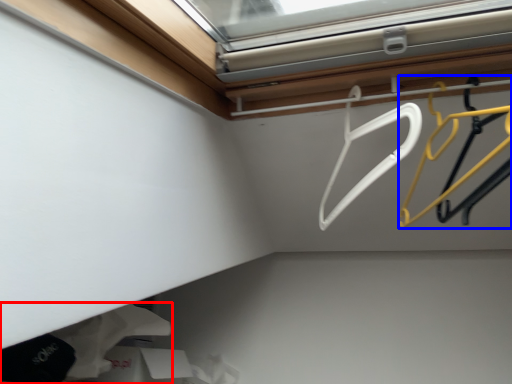
Question: Among these objects, which one is farthest to the camera, clothing (highlighted by a red box) or hanger (highlighted by a blue box)?

Choices:
 (A) clothing
 (B) hanger

Answer: (A)